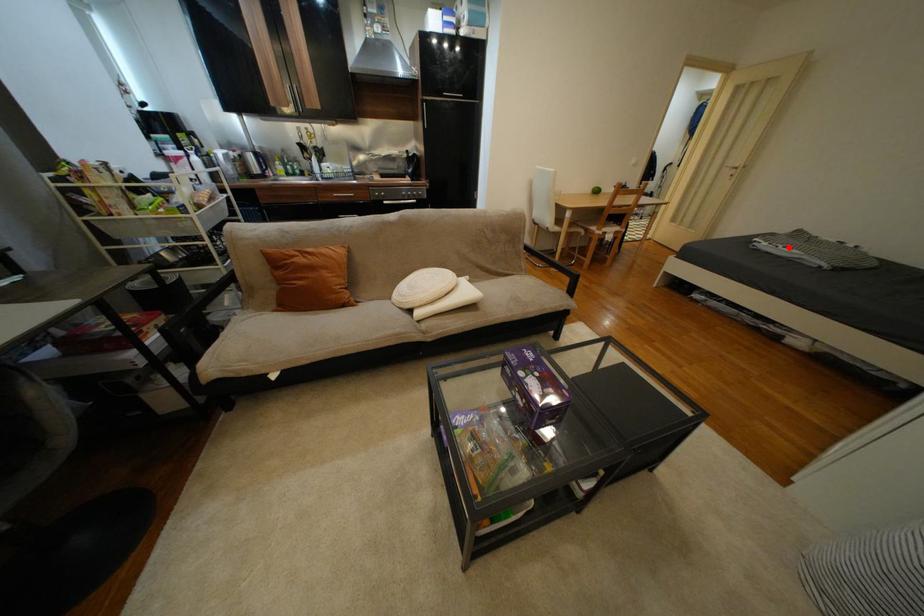
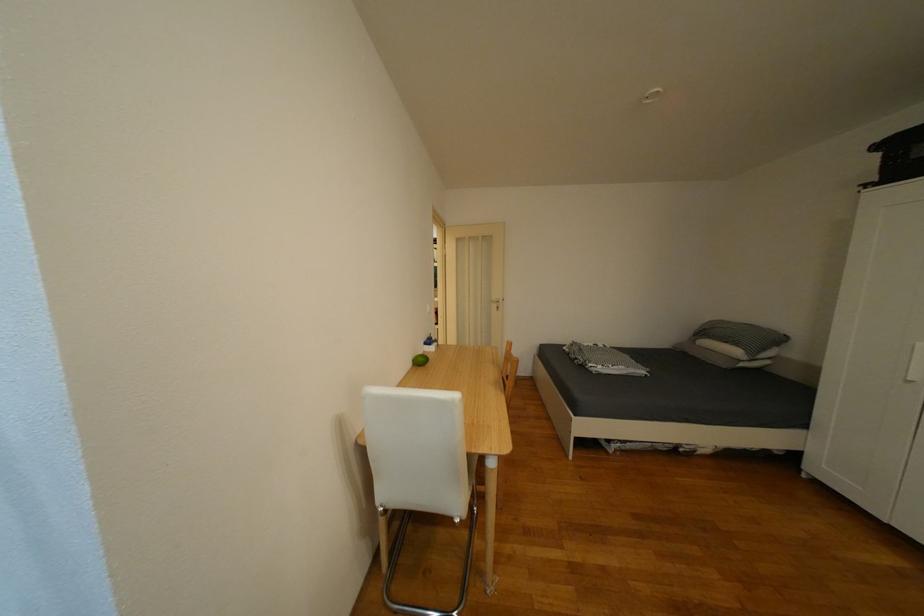
Find the pixel in the second image that matches the highlighted location in the first image.

(618, 368)